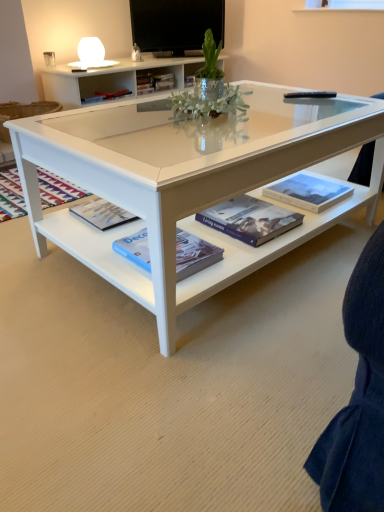
Question: Which direction should I rotate to face hardcover book at center, acting as the first book starting from the top, — up or down?

Choices:
 (A) up
 (B) down

Answer: (A)

Question: Does hardcover book at center, marked as the 1th book in a right-to-left arrangement, have a greater height compared to hardcover book at center, placed as the fourth book when sorted from bottom to top?

Choices:
 (A) yes
 (B) no

Answer: (A)

Question: Considering the relative positions of hardcover book at center, marked as the 1th book in a right-to-left arrangement, and hardcover book at center, placed as the fourth book when sorted from bottom to top, in the image provided, is hardcover book at center, marked as the 1th book in a right-to-left arrangement, behind hardcover book at center, placed as the fourth book when sorted from bottom to top,?

Choices:
 (A) yes
 (B) no

Answer: (B)

Question: Can you confirm if hardcover book at center, positioned as the third book in front-to-back order, is shorter than hardcover book at center, the 1th book viewed from the back?

Choices:
 (A) yes
 (B) no

Answer: (B)

Question: Is hardcover book at center, acting as the 4th book starting from the left, not within hardcover book at center, the 1th book viewed from the back?

Choices:
 (A) no
 (B) yes

Answer: (B)

Question: Is hardcover book at center, positioned as the third book in front-to-back order, smaller than hardcover book at center, the first book from the left?

Choices:
 (A) no
 (B) yes

Answer: (A)

Question: Can hardcover book at center, placed as the fourth book when sorted from bottom to top, be found inside hardcover book at center, the third book when ordered from bottom to top?

Choices:
 (A) yes
 (B) no

Answer: (B)

Question: Can you confirm if hardcover book at center, the 2th book from the bottom, is taller than hardcover book at center, acting as the 4th book starting from the left?

Choices:
 (A) no
 (B) yes

Answer: (A)

Question: Does hardcover book at center, marked as the 3th book in a back-to-front arrangement, have a greater width compared to hardcover book at center, marked as the 1th book in a right-to-left arrangement?

Choices:
 (A) yes
 (B) no

Answer: (A)

Question: Is there a large distance between hardcover book at center, arranged as the 3th book when viewed from the left, and hardcover book at center, which appears as the second book when viewed from the back?

Choices:
 (A) no
 (B) yes

Answer: (A)

Question: Is hardcover book at center, arranged as the 3th book when viewed from the left, oriented away from hardcover book at center, placed as the 2th book when sorted from top to bottom?

Choices:
 (A) yes
 (B) no

Answer: (B)

Question: Is hardcover book at center, arranged as the 3th book when viewed from the left, further to camera compared to hardcover book at center, placed as the 2th book when sorted from top to bottom?

Choices:
 (A) no
 (B) yes

Answer: (A)

Question: Would you say hardcover book at center, placed as the 2th book when sorted from top to bottom, is part of hardcover book at center, arranged as the 3th book when viewed from the left,'s contents?

Choices:
 (A) no
 (B) yes

Answer: (A)

Question: Considering the relative sizes of flat screen tv at upper center and hardcover book at center, which is the fourth book in right-to-left order, in the image provided, is flat screen tv at upper center taller than hardcover book at center, which is the fourth book in right-to-left order,?

Choices:
 (A) yes
 (B) no

Answer: (A)